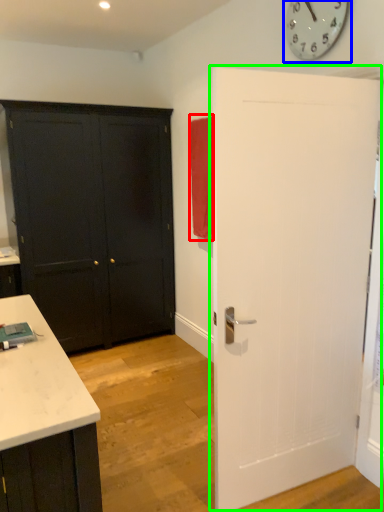
Question: Based on their relative distances, which object is nearer to curtain (highlighted by a red box)? Choose from clock (highlighted by a blue box) and door (highlighted by a green box).

Choices:
 (A) clock
 (B) door

Answer: (A)